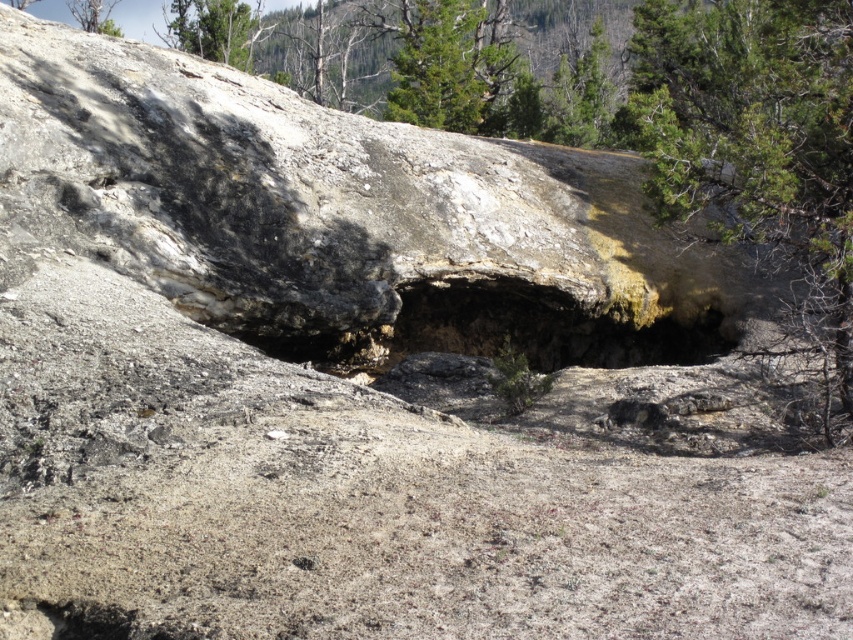
Who is positioned more to the right, green leafy tree at right or dark rock cave at center?

From the viewer's perspective, green leafy tree at right appears more on the right side.

Who is more forward, (776, 12) or (619, 333)?

Point (776, 12)

Which is in front, point (740, 42) or point (444, 291)?

Point (444, 291) is in front.

Find the location of `green leafy tree at right`. green leafy tree at right is located at coordinates (756, 140).

Is green leafy tree at right closer to the viewer compared to green textured tree at upper center?

That is True.

Between point (730, 67) and point (439, 72), which one is positioned in front?

Point (730, 67) is in front.

Identify the location of green leafy tree at right. This screenshot has height=640, width=853. (756, 140).

Which is below, dark rock cave at center or green textured tree at upper center?

Positioned lower is dark rock cave at center.

Can you confirm if dark rock cave at center is taller than green textured tree at upper center?

Incorrect, dark rock cave at center's height is not larger of green textured tree at upper center's.

Find the location of a particular element. The image size is (853, 640). dark rock cave at center is located at coordinates (544, 326).